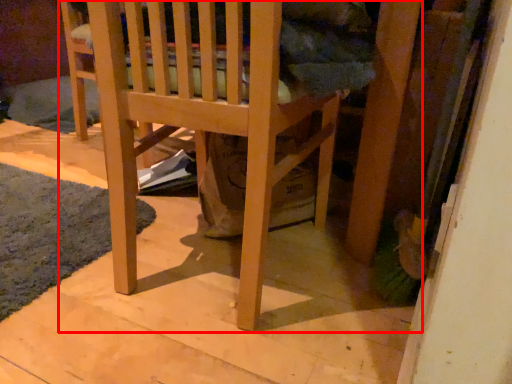
Question: Where is furniture (annotated by the red box) located in relation to mat in the image?

Choices:
 (A) right
 (B) left

Answer: (A)